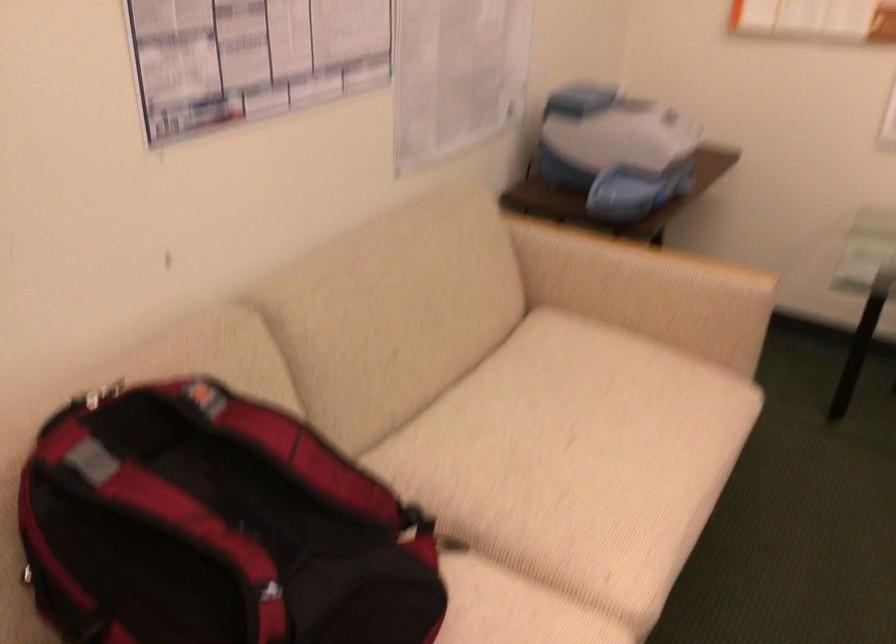
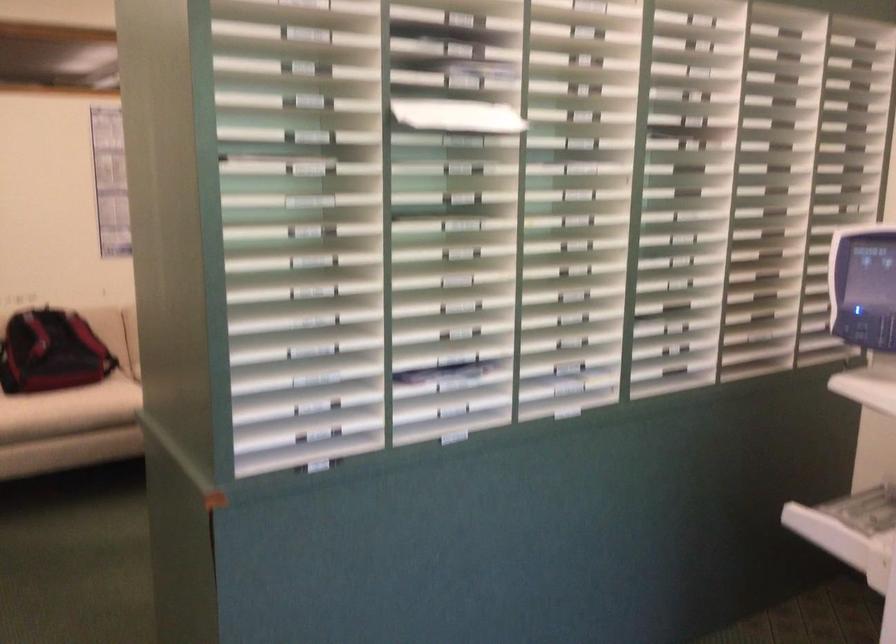
Which direction would the cameraman need to move to produce the second image?

The movement direction of the cameraman is right, backward.